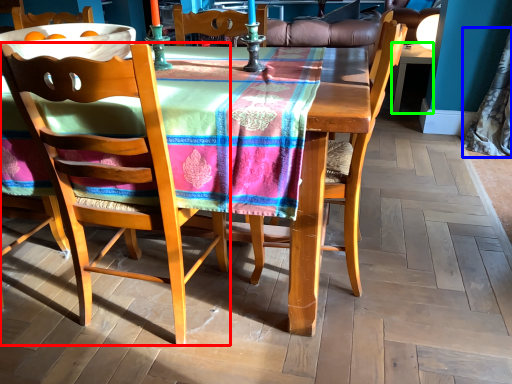
Question: Considering the real-world distances, which object is farthest from chair (highlighted by a red box)? curtain (highlighted by a blue box) or desk (highlighted by a green box)?

Choices:
 (A) curtain
 (B) desk

Answer: (B)